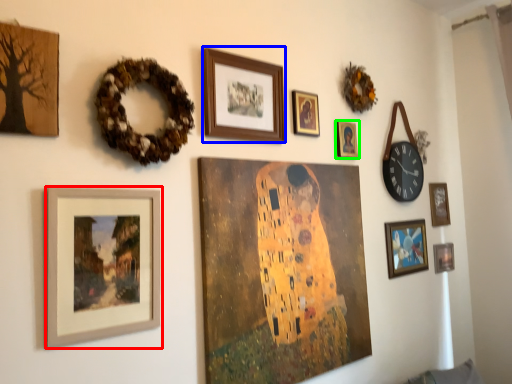
Question: Based on their relative distances, which object is farther from picture frame (highlighted by a red box)? Choose from picture frame (highlighted by a blue box) and picture frame (highlighted by a green box).

Choices:
 (A) picture frame
 (B) picture frame

Answer: (B)